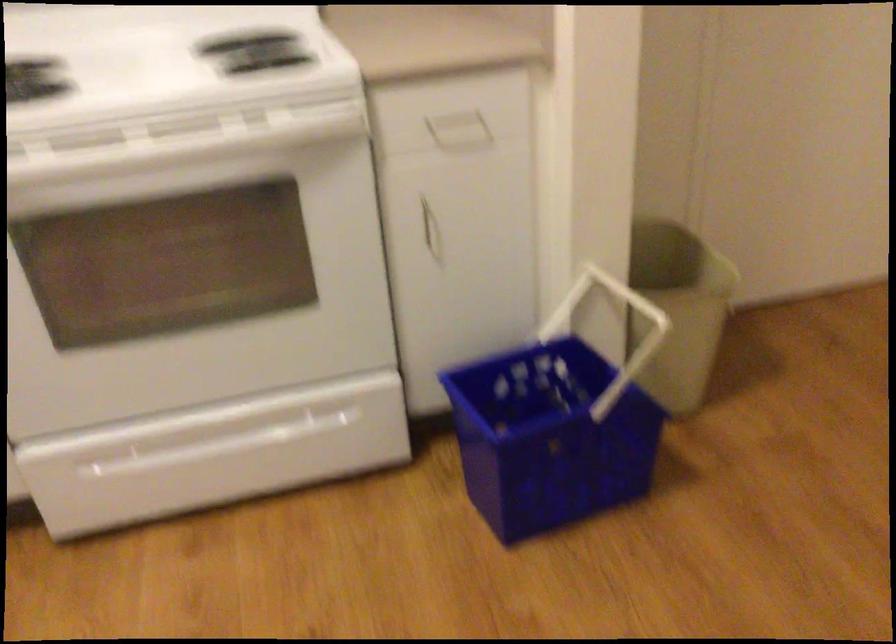
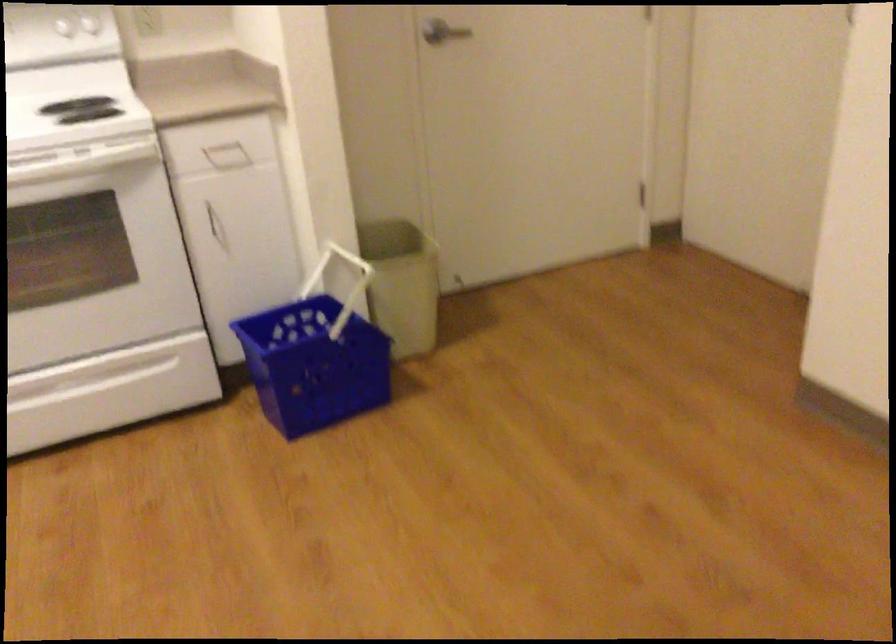
Question: I am providing you with two images of the same scene from different viewpoints. Which of the following objects are not visible in image2?

Choices:
 (A) patterned plate
 (B) white basket handle
 (C) white cabinet handle
 (D) beige trash can

Answer: (B)